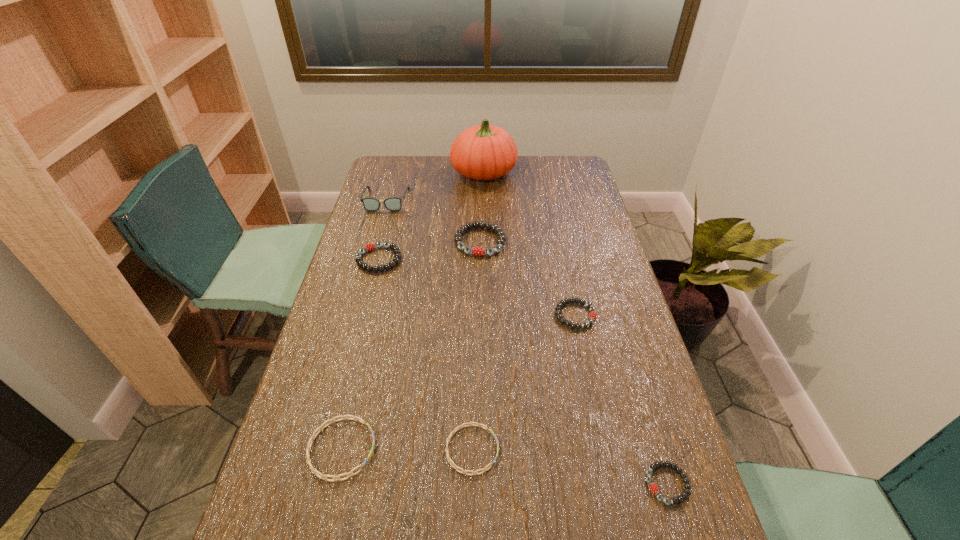
At what (x,y) coordinates should I click in order to perform the action: click on the third biggest black bracelet. Please return your answer as a coordinate pair (x, y). The width and height of the screenshot is (960, 540). Looking at the image, I should click on coord(593,315).

Identify the location of the smaller blue bracelet. (471, 423).

Locate an element on the screen. The image size is (960, 540). the rightmost black bracelet is located at coordinates (684, 496).

I want to click on the smallest black bracelet, so click(684, 496).

Where is `vacant space located 0.190m on the front of the pumpkin`? This screenshot has height=540, width=960. vacant space located 0.190m on the front of the pumpkin is located at coordinates (484, 218).

Where is `free region located 0.250m on the face of the seventh shortest object`? Image resolution: width=960 pixels, height=540 pixels. free region located 0.250m on the face of the seventh shortest object is located at coordinates (372, 255).

What are the coordinates of `free space located 0.120m on the back of the sixth shortest object` in the screenshot? It's located at (480, 207).

The width and height of the screenshot is (960, 540). In order to click on vacant area located 0.240m on the back of the third smallest black bracelet in this screenshot , I will do `click(392, 206)`.

The width and height of the screenshot is (960, 540). Find the location of `vacant space located 0.100m on the surface of the bigger blue bracelet showing star-shaped elements`. vacant space located 0.100m on the surface of the bigger blue bracelet showing star-shaped elements is located at coordinates (420, 449).

I want to click on vacant space located 0.210m on the front of the fourth nearest bracelet, so click(593, 397).